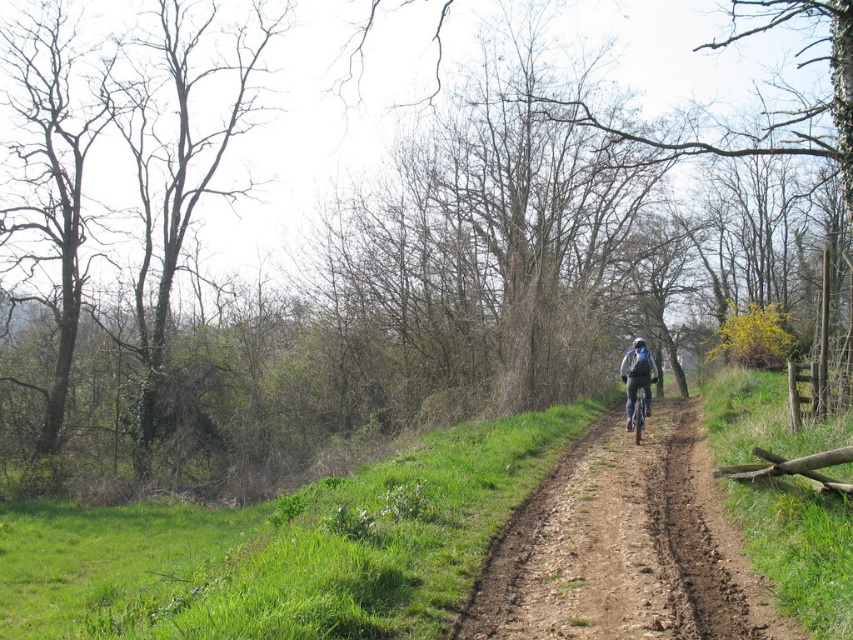
You are planning to ride a matte black bicycle at center along the brown dirt track at center. Considering the width of the track, do you think you can ride the bicycle without needing to move sideways?

The brown dirt track at center is wider than the matte black bicycle at center, so you can ride the bicycle without needing to move sideways.

You are standing at the starting point of the dirt path and want to reach a destination located at point (x=628, y=392). There is an obstacle at point (x=653, y=372). Will you encounter the obstacle before reaching your destination?

Point (x=653, y=372) is behind point (x=628, y=392), so you will not encounter the obstacle at point (x=653, y=372) before reaching your destination at point (x=628, y=392).